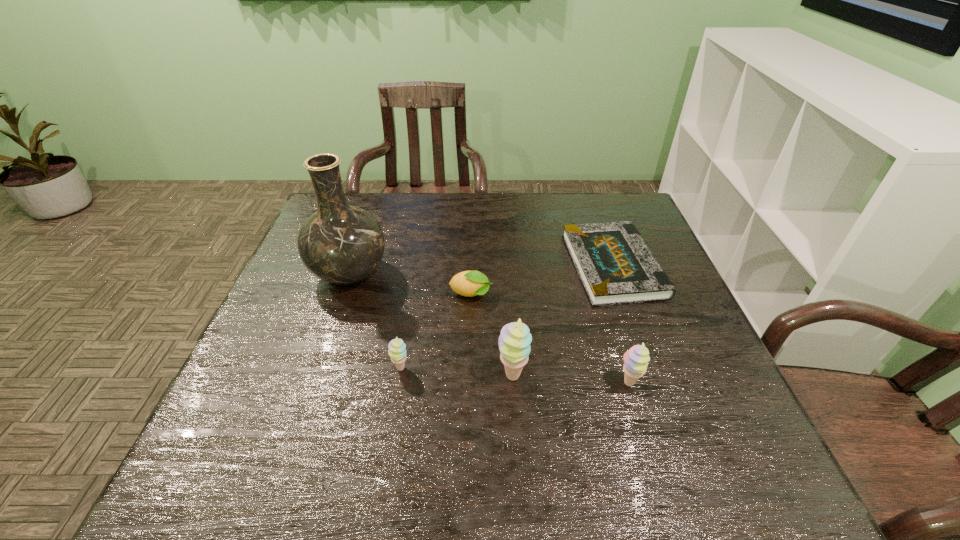
Choose which sherbert is the nearest neighbor to the third object from right to left. Please provide its 2D coordinates. Your answer should be formatted as a tuple, i.e. [(x, y)], where the tuple contains the x and y coordinates of a point satisfying the conditions above.

[(636, 359)]

Where is `vacant space that satisfies the following two spatial constraints: 1. on the front side of the tallest sherbert; 2. on the right side of the third shortest object`? Image resolution: width=960 pixels, height=540 pixels. vacant space that satisfies the following two spatial constraints: 1. on the front side of the tallest sherbert; 2. on the right side of the third shortest object is located at coordinates (399, 376).

Find the location of a particular element. The height and width of the screenshot is (540, 960). free space that satisfies the following two spatial constraints: 1. on the front side of the second tallest object; 2. on the right side of the rightmost sherbert is located at coordinates (513, 384).

Locate an element on the screen. This screenshot has height=540, width=960. vacant point that satisfies the following two spatial constraints: 1. on the back side of the notebook; 2. on the left side of the second tallest object is located at coordinates (505, 266).